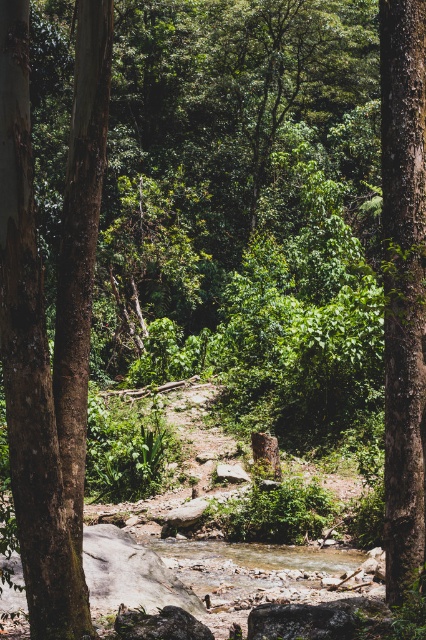
You are a hiker standing in the middle of the forest scene. You see the brown rough bark tree at left and the smooth brown tree trunk at right. Which tree is positioned closer to your left side?

The brown rough bark tree at left is positioned closer to your left side than the smooth brown tree trunk at right.

You are a hiker carrying a 6.5 feet long wooden plank. You need to cross the stream between the brown rough bark tree at left and the smooth brown tree trunk at right. Can you place the plank horizontally to cross the stream?

The distance between the brown rough bark tree at left and the smooth brown tree trunk at right is 6.76 feet. Since your plank is 6.5 feet long, it is slightly shorter than the required distance. Therefore, the plank would not reach across the stream, making it unsafe to cross this way.

You are a hiker who wants to take a photo of both the brown rough bark tree at left and the smooth brown tree trunk at right in the same frame. Which tree should you move closer to so that both trees appear equally sized in your photo?

You should move closer to the brown rough bark tree at left because it is shorter than the smooth brown tree trunk at right. By moving closer to the shorter tree, you can make both trees appear similar in size in the photo.